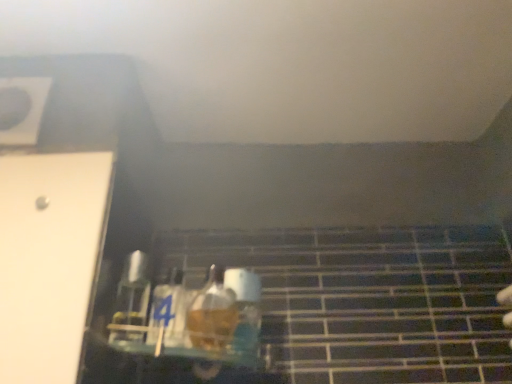
Describe the element at coordinates (245, 309) in the screenshot. The width and height of the screenshot is (512, 384). I see `translucent glass bottle at center` at that location.

This screenshot has width=512, height=384. Identify the location of translucent glass bottle at center. (245, 309).

What is the approximate width of translucent glass bottle at center?

4.36 centimeters.

Where is `translucent glass bottle at center`? The image size is (512, 384). translucent glass bottle at center is located at coordinates (245, 309).